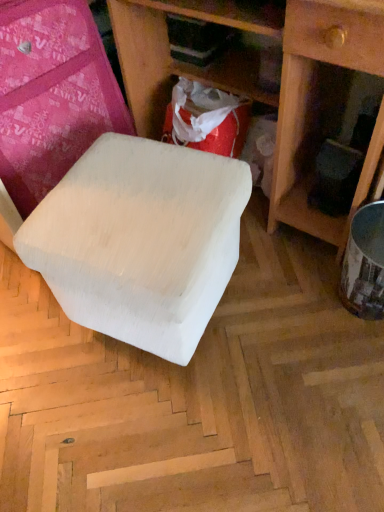
This screenshot has height=512, width=384. In order to click on free region on the left part of white matte stool at center in this screenshot , I will do click(x=35, y=345).